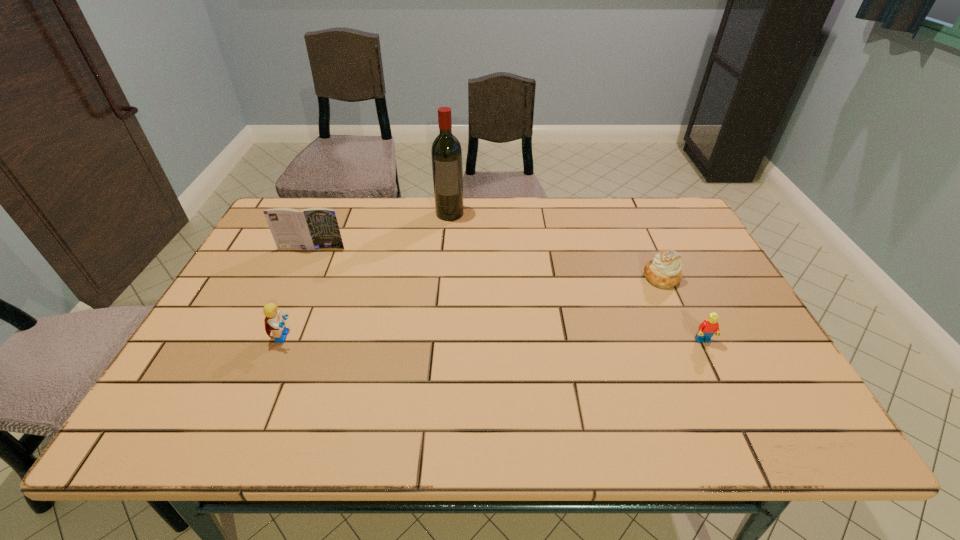
Image resolution: width=960 pixels, height=540 pixels. Identify the location of free spot at the right edge of the desktop. (675, 242).

Locate an element on the screen. Image resolution: width=960 pixels, height=540 pixels. vacant space at the far right corner of the desktop is located at coordinates (642, 197).

Where is `empty space that is in between the second tallest object and the third farthest object`? The height and width of the screenshot is (540, 960). empty space that is in between the second tallest object and the third farthest object is located at coordinates (487, 262).

This screenshot has height=540, width=960. What are the coordinates of `vacant area that lies between the book and the tallest object` in the screenshot? It's located at (381, 231).

Locate an element on the screen. vacant space in between the right Lego and the wine bottle is located at coordinates (576, 277).

Where is `vacant space that is in between the tallest object and the shorter Lego`? This screenshot has height=540, width=960. vacant space that is in between the tallest object and the shorter Lego is located at coordinates (576, 277).

Identify the location of free space between the shorter Lego and the book. The image size is (960, 540). (507, 294).

Find the location of `free space between the left Lego and the book`. free space between the left Lego and the book is located at coordinates (298, 292).

At what (x,y) coordinates should I click in order to perform the action: click on vacant area that lies between the third farthest object and the second tallest object. Please return your answer as a coordinate pair (x, y). This screenshot has height=540, width=960. Looking at the image, I should click on (487, 262).

Identify the location of vacant area between the right Lego and the wine bottle. (576, 277).